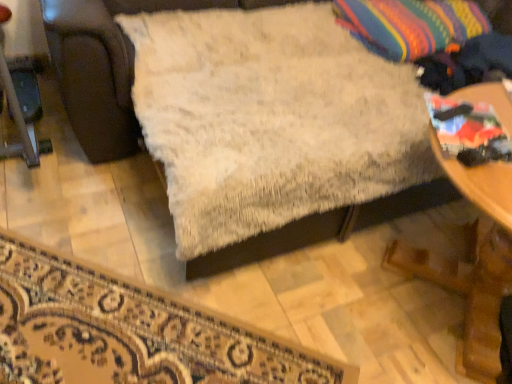
Question: Does multicolored woven throw pillow at upper right have a greater width compared to white fluffy blanket at center?

Choices:
 (A) no
 (B) yes

Answer: (A)

Question: Is multicolored woven throw pillow at upper right positioned before white fluffy blanket at center?

Choices:
 (A) no
 (B) yes

Answer: (A)

Question: From a real-world perspective, is multicolored woven throw pillow at upper right below white fluffy blanket at center?

Choices:
 (A) no
 (B) yes

Answer: (A)

Question: From a real-world perspective, is multicolored woven throw pillow at upper right positioned over white fluffy blanket at center based on gravity?

Choices:
 (A) no
 (B) yes

Answer: (B)

Question: Is white fluffy blanket at center surrounded by multicolored woven throw pillow at upper right?

Choices:
 (A) no
 (B) yes

Answer: (A)

Question: Considering the positions of point (504, 264) and point (249, 124), is point (504, 264) closer or farther from the camera than point (249, 124)?

Choices:
 (A) closer
 (B) farther

Answer: (A)

Question: Considering the positions of wooden table at lower right and white fluffy blanket at center in the image, is wooden table at lower right bigger or smaller than white fluffy blanket at center?

Choices:
 (A) small
 (B) big

Answer: (A)

Question: From the image's perspective, relative to white fluffy blanket at center, is wooden table at lower right above or below?

Choices:
 (A) below
 (B) above

Answer: (A)

Question: From a real-world perspective, is wooden table at lower right positioned above or below white fluffy blanket at center?

Choices:
 (A) above
 (B) below

Answer: (B)

Question: In the image, is wooden table at lower right on the left side or the right side of multicolored woven throw pillow at upper right?

Choices:
 (A) left
 (B) right

Answer: (B)

Question: From the image's perspective, is wooden table at lower right located above or below multicolored woven throw pillow at upper right?

Choices:
 (A) above
 (B) below

Answer: (B)

Question: From a real-world perspective, is wooden table at lower right above or below multicolored woven throw pillow at upper right?

Choices:
 (A) below
 (B) above

Answer: (A)

Question: In the image, is wooden table at lower right positioned in front of or behind multicolored woven throw pillow at upper right?

Choices:
 (A) behind
 (B) front

Answer: (B)

Question: Does point (248, 231) appear closer or farther from the camera than point (150, 350)?

Choices:
 (A) farther
 (B) closer

Answer: (A)

Question: From a real-world perspective, is white fluffy blanket at center above or below white fluffy rug at lower center?

Choices:
 (A) above
 (B) below

Answer: (A)